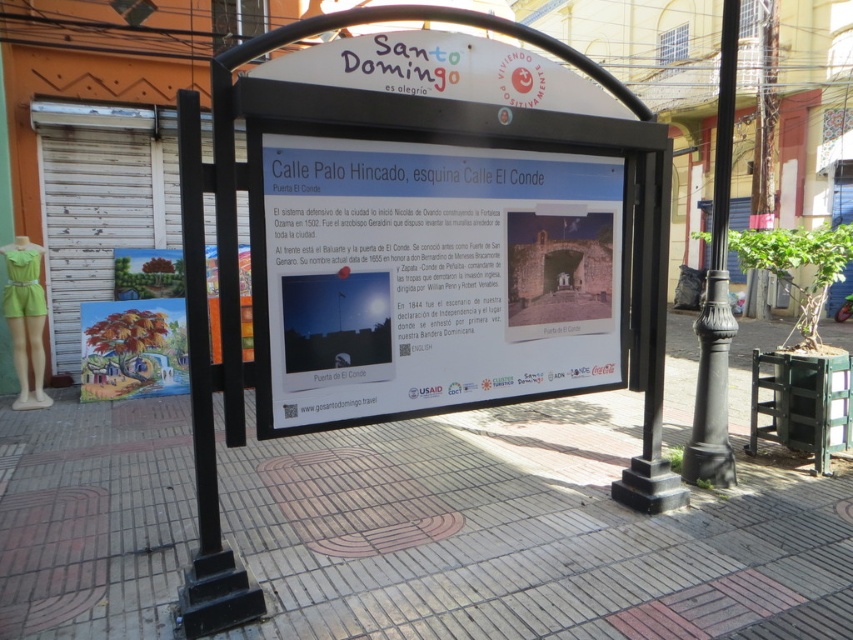
You are a delivery person with a 1.2 meter wide cart. You need to navigate through the area shown in the image. Can your cart pass through the space between the smooth concrete sidewalk at center and the black metal sign at center?

The smooth concrete sidewalk at center is thinner than the black metal sign at center, so the space between them is wider than the sidewalk. Since your cart is 1.2 meters wide, it should be able to pass through the space between the smooth concrete sidewalk at center and the black metal sign at center as long as the total available width accommodates the cart.

You are a city planner assessing the layout of the public information board. The smooth concrete sidewalk at center and the black metal sign at center are both part of the board structure. Which of these two elements is longer in length?

The smooth concrete sidewalk at center is shorter than the black metal sign at center, so the black metal sign at center is longer in length.